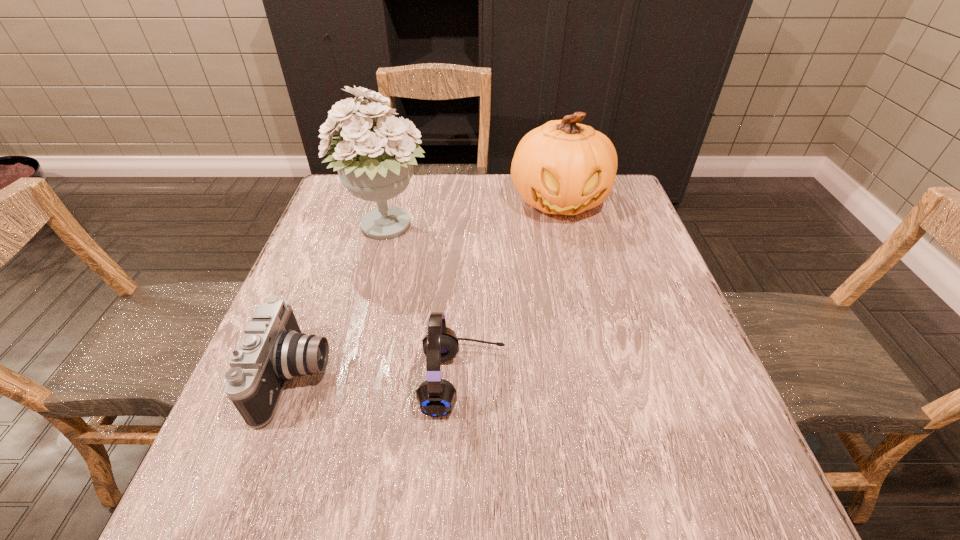
Where is `vacant space in between the bouquet and the camera`? The height and width of the screenshot is (540, 960). vacant space in between the bouquet and the camera is located at coordinates (342, 302).

This screenshot has width=960, height=540. Identify the location of the second closest object relative to the camera. (376, 165).

Where is `object that is the third closest to the camera`? The height and width of the screenshot is (540, 960). object that is the third closest to the camera is located at coordinates coord(562,167).

The height and width of the screenshot is (540, 960). Identify the location of free space that satisfies the following two spatial constraints: 1. on the front face of the pumpkin; 2. on the front-facing side of the camera. (601, 376).

The width and height of the screenshot is (960, 540). Find the location of `free space in the image that satisfies the following two spatial constraints: 1. on the front face of the pumpkin; 2. on the ear cushions of the headset`. free space in the image that satisfies the following two spatial constraints: 1. on the front face of the pumpkin; 2. on the ear cushions of the headset is located at coordinates (602, 381).

Identify the location of vacant position in the image that satisfies the following two spatial constraints: 1. on the front side of the tallest object; 2. on the front-facing side of the camera. (348, 376).

This screenshot has width=960, height=540. I want to click on free point that satisfies the following two spatial constraints: 1. on the front face of the pumpkin; 2. on the ear cushions of the headset, so click(x=602, y=381).

Locate an element on the screen. The image size is (960, 540). free space that satisfies the following two spatial constraints: 1. on the front face of the pumpkin; 2. on the front-facing side of the camera is located at coordinates (601, 376).